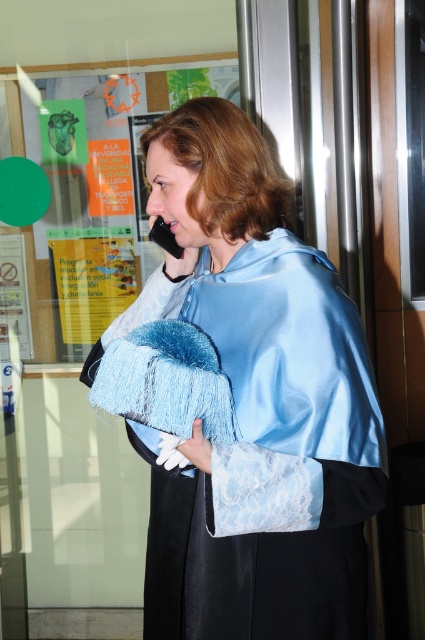
You are a photographer trying to capture the woman in the scene. To ensure the green paper at upper left is visible in the frame, where should you position the camera relative to the satin blue cape at center?

The satin blue cape at center is below the green paper at upper left, so positioning the camera above the satin blue cape at center will allow the green paper at upper left to be visible in the frame.

You are a photographer trying to capture a clear shot of the woman in the scene. Since you want the green paper at upper left to be visible in the background, will the satin blue cape at center block your view of it?

The satin blue cape at center is closer to the viewer than the green paper at upper left, so it will block the view of the green paper at upper left in the background.

You are an interior designer assessing the decor of this room. The satin blue cape at center and the green paper at upper left are both part of the room decor. Which object has a greater width?

The green paper at upper left has a greater width than the satin blue cape at center because the satin blue cape at center is thinner than green paper at upper left.